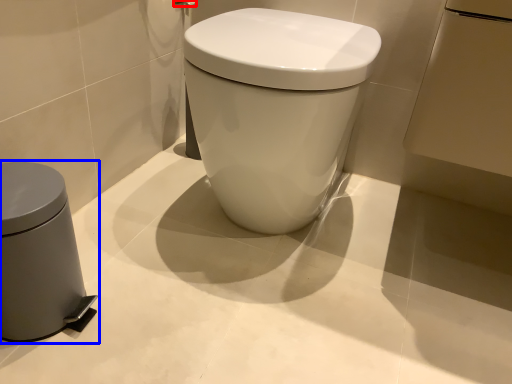
Question: Among these objects, which one is nearest to the camera, towel bar (highlighted by a red box) or waste container (highlighted by a blue box)?

Choices:
 (A) towel bar
 (B) waste container

Answer: (B)